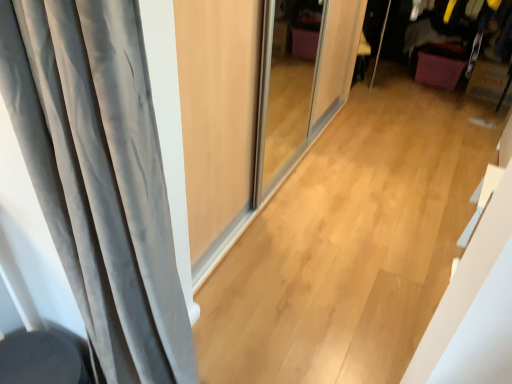
The width and height of the screenshot is (512, 384). What do you see at coordinates (254, 103) in the screenshot? I see `satin gray curtain at left` at bounding box center [254, 103].

Where is `satin gray curtain at left`? The width and height of the screenshot is (512, 384). satin gray curtain at left is located at coordinates (254, 103).

Measure the distance between satin gray curtain at left and camera.

1.12 meters.

Locate an element on the screen. satin gray curtain at left is located at coordinates (254, 103).